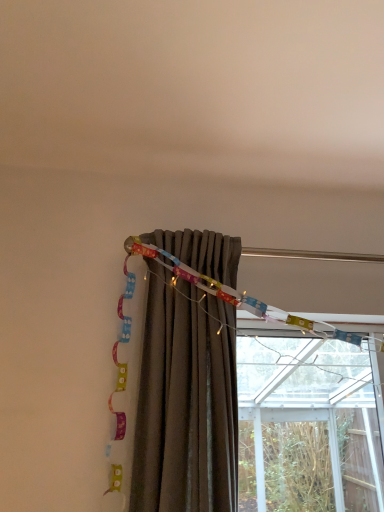
The height and width of the screenshot is (512, 384). Describe the element at coordinates (186, 401) in the screenshot. I see `brown fabric curtain at center` at that location.

At what (x,y) coordinates should I click in order to perform the action: click on brown fabric curtain at center. Please return your answer as a coordinate pair (x, y). This screenshot has width=384, height=512. Looking at the image, I should click on (186, 401).

The height and width of the screenshot is (512, 384). I want to click on brown fabric curtain at center, so click(x=186, y=401).